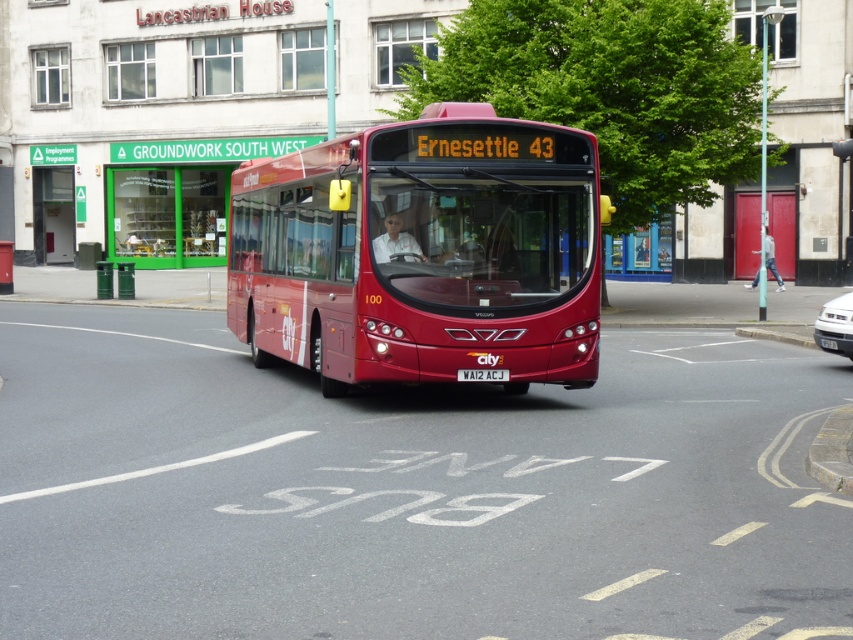
Question: Estimate the real-world distances between objects in this image. Which object is farther from the silver metallic car at right?

Choices:
 (A) shiny red bus at center
 (B) white plastic license plate at center

Answer: (A)

Question: Observing the image, what is the correct spatial positioning of shiny red bus at center in reference to silver metallic car at right?

Choices:
 (A) below
 (B) above

Answer: (B)

Question: Does shiny red bus at center have a greater width compared to silver metallic car at right?

Choices:
 (A) no
 (B) yes

Answer: (A)

Question: Which point is farther from the camera taking this photo?

Choices:
 (A) (827, 333)
 (B) (460, 372)

Answer: (A)

Question: Which object is farther from the camera taking this photo?

Choices:
 (A) shiny red bus at center
 (B) silver metallic car at right

Answer: (B)

Question: Can you confirm if shiny red bus at center is bigger than white plastic license plate at center?

Choices:
 (A) yes
 (B) no

Answer: (A)